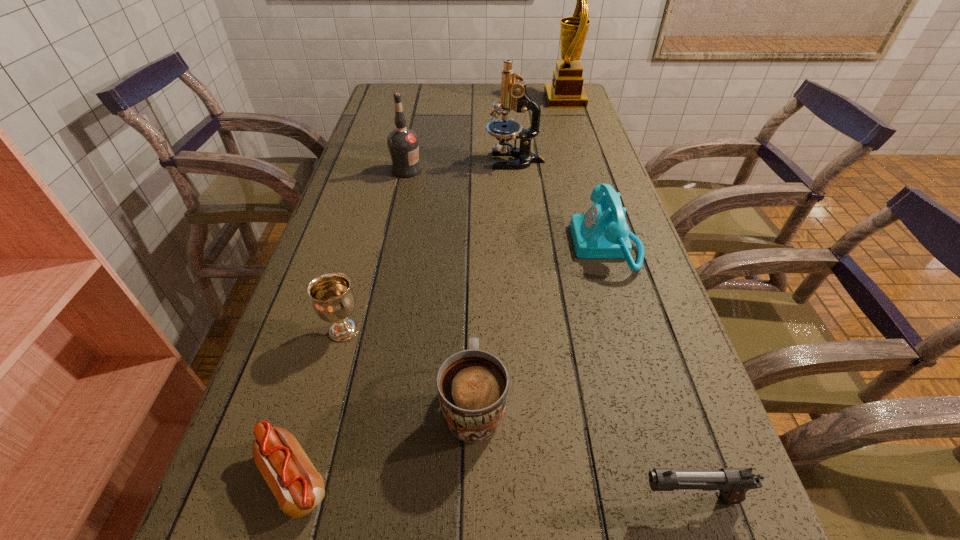
Locate an element on the screen. Image resolution: width=960 pixels, height=540 pixels. free space between the farthest object and the vodka is located at coordinates (486, 135).

You are a GUI agent. You are given a task and a screenshot of the screen. Output one action in this format:
    pyautogui.click(x=<x>, y=<y>)
    Task: Click on the free space between the mug and the telephone
    This screenshot has width=960, height=540.
    Given the screenshot: What is the action you would take?
    pyautogui.click(x=540, y=325)

Identify the location of free space between the chalice and the sixth shortest object. (375, 250).

Locate an element on the screen. unoccupied position between the gun and the chalice is located at coordinates (516, 414).

Where is `free space between the fifth farthest object and the shortest object`? free space between the fifth farthest object and the shortest object is located at coordinates (320, 404).

The width and height of the screenshot is (960, 540). I want to click on vacant space that's between the microscope and the sausage, so click(405, 320).

The width and height of the screenshot is (960, 540). In order to click on free spot between the fifth farthest object and the mug in this screenshot , I will do `click(409, 367)`.

This screenshot has height=540, width=960. What are the coordinates of `the seventh closest object to the telephone` in the screenshot? It's located at (566, 91).

Identify the location of object that is the seventh nearest to the tallest object. (298, 487).

At what (x,y) coordinates should I click in order to perform the action: click on blank area in the image that satisfies the following two spatial constraints: 1. on the side of the mug with the handle; 2. on the front label of the third tallest object. Please return your answer as a coordinate pair (x, y). Looking at the image, I should click on (476, 170).